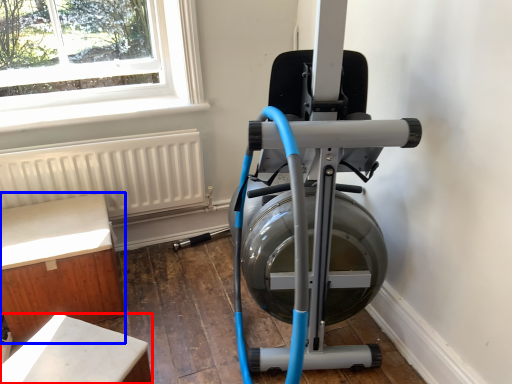
Question: Which object is further to the camera taking this photo, furniture (highlighted by a red box) or furniture (highlighted by a blue box)?

Choices:
 (A) furniture
 (B) furniture

Answer: (B)